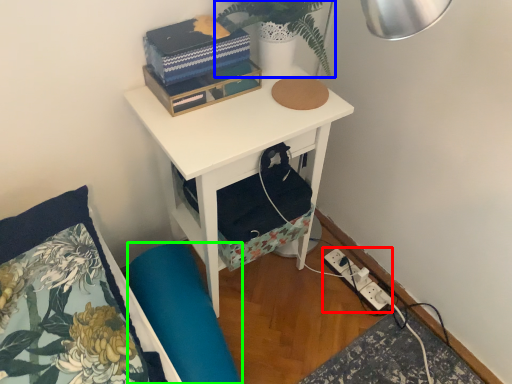
Question: Which is farther away from electric outlet (highlighted by a red box)? plant (highlighted by a blue box) or swivel chair (highlighted by a green box)?

Choices:
 (A) plant
 (B) swivel chair

Answer: (A)